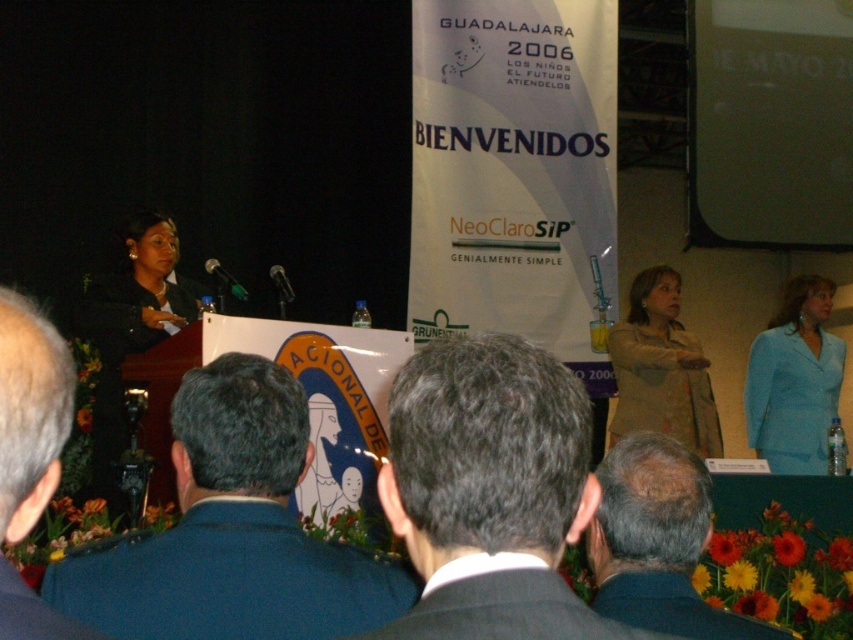
You are an attendee at the event and want to know the spatial relationship between the black fabric at left and the tan fabric jacket at center. Which one is positioned to the left?

The black fabric at left is positioned to the left of the tan fabric jacket at center.

You are an attendee at the event and want to see both the gray hair at left and the tan fabric jacket at center clearly. Which object is closer to you? Please explain.

The gray hair at left is closer to you because it is in front of the tan fabric jacket at center.

You are a photographer positioned at the back of the room. You need to capture a photo that includes both the gray hair at left and the tan fabric jacket at center. Given that your camera has a maximum zoom range of 3.5 meters, will you be able to frame both subjects within the shot?

The distance between the gray hair at left and the tan fabric jacket at center is 4.16 meters. Since your camera can only zoom up to 3.5 meters, you won